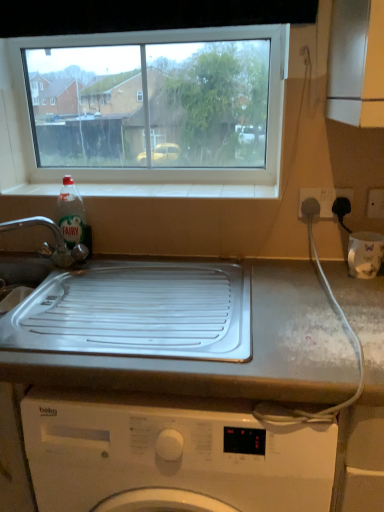
The height and width of the screenshot is (512, 384). I want to click on vacant area on top of white glossy countertop at center (from a real-world perspective), so click(x=211, y=329).